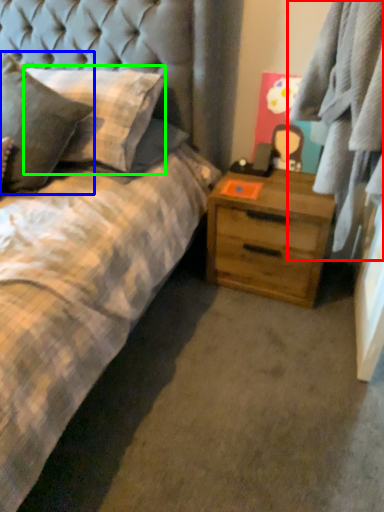
Question: Estimate the real-world distances between objects in this image. Which object is farther from plaid (highlighted by a red box), pillow (highlighted by a blue box) or pillow (highlighted by a green box)?

Choices:
 (A) pillow
 (B) pillow

Answer: (A)